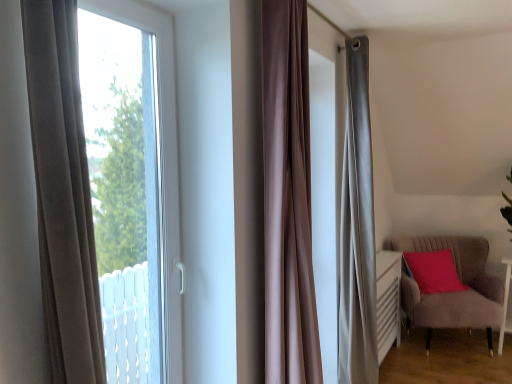
Question: Is velvet grey armchair at lower right beside transparent glass window at left?

Choices:
 (A) no
 (B) yes

Answer: (A)

Question: Is velvet grey armchair at lower right turned away from transparent glass window at left?

Choices:
 (A) yes
 (B) no

Answer: (B)

Question: Considering the relative positions of velvet grey armchair at lower right and transparent glass window at left in the image provided, is velvet grey armchair at lower right to the left of transparent glass window at left from the viewer's perspective?

Choices:
 (A) yes
 (B) no

Answer: (B)

Question: Is velvet grey armchair at lower right facing towards transparent glass window at left?

Choices:
 (A) yes
 (B) no

Answer: (B)

Question: Is velvet grey armchair at lower right behind transparent glass window at left?

Choices:
 (A) yes
 (B) no

Answer: (A)

Question: Considering the relative sizes of velvet grey armchair at lower right and transparent glass window at left in the image provided, is velvet grey armchair at lower right thinner than transparent glass window at left?

Choices:
 (A) yes
 (B) no

Answer: (B)

Question: From a real-world perspective, is satin brown curtain at center below white glossy side table at lower right?

Choices:
 (A) yes
 (B) no

Answer: (B)

Question: Are satin brown curtain at center and white glossy side table at lower right located far from each other?

Choices:
 (A) no
 (B) yes

Answer: (B)

Question: Is satin brown curtain at center positioned in front of white glossy side table at lower right?

Choices:
 (A) no
 (B) yes

Answer: (B)

Question: Is white glossy side table at lower right a part of satin brown curtain at center?

Choices:
 (A) yes
 (B) no

Answer: (B)

Question: From a real-world perspective, is satin brown curtain at center on top of white glossy side table at lower right?

Choices:
 (A) yes
 (B) no

Answer: (A)

Question: Are satin brown curtain at center and white glossy side table at lower right beside each other?

Choices:
 (A) yes
 (B) no

Answer: (B)

Question: Considering the relative sizes of matte pink cushion at right and satin brown curtain at center in the image provided, is matte pink cushion at right shorter than satin brown curtain at center?

Choices:
 (A) no
 (B) yes

Answer: (B)